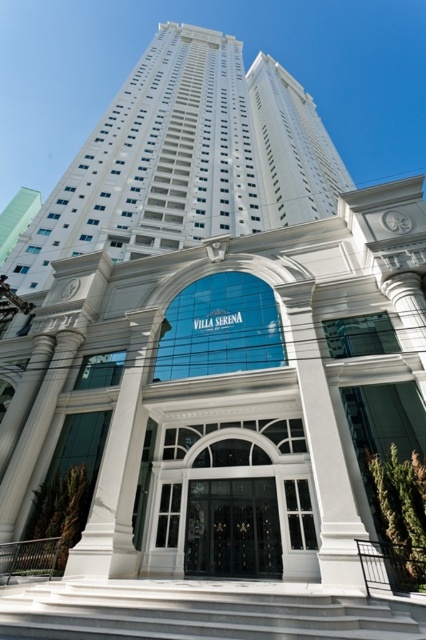
You are a visitor approaching the entrance of Villa Serena. You see the white smooth building at upper center and the black glass door at center. Which object is positioned higher relative to the other?

The white smooth building at upper center is positioned higher than the black glass door at center.

Consider the image. You are an architect evaluating the design of Villa Serena. You need to determine if the white smooth building at upper center can be placed in a space that can only accommodate objects up to the width of the black glass door at center. Based on the image, is this feasible?

The white smooth building at upper center is wider than the black glass door at center, so it cannot be placed in a space that can only accommodate the door width.